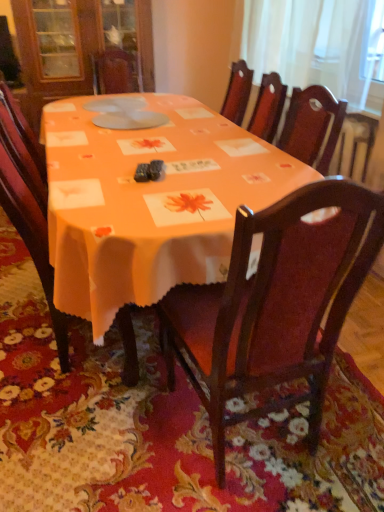
Question: Is wooden chair at center, marked as the 1th chair in a left-to-right arrangement, shorter than wooden chair at center, the first chair when ordered from right to left?

Choices:
 (A) no
 (B) yes

Answer: (B)

Question: From the image's perspective, does wooden chair at center, the 2th chair viewed from the right, appear lower than wooden chair at center, the first chair when ordered from right to left?

Choices:
 (A) yes
 (B) no

Answer: (B)

Question: Is wooden chair at center, the 2th chair viewed from the right, wider than wooden chair at center, the 2th chair when ordered from left to right?

Choices:
 (A) yes
 (B) no

Answer: (B)

Question: Is wooden chair at center, marked as the 1th chair in a left-to-right arrangement, positioned behind wooden chair at center, the first chair when ordered from right to left?

Choices:
 (A) no
 (B) yes

Answer: (B)

Question: From a real-world perspective, is wooden chair at center, the 2th chair viewed from the right, under wooden chair at center, the 2th chair when ordered from left to right?

Choices:
 (A) yes
 (B) no

Answer: (A)

Question: Is wooden chair at center, the 2th chair viewed from the right, oriented towards wooden chair at center, the first chair when ordered from right to left?

Choices:
 (A) yes
 (B) no

Answer: (B)

Question: From a real-world perspective, is orange fabric table at center located higher than wooden chair at center, the 2th chair viewed from the right?

Choices:
 (A) no
 (B) yes

Answer: (A)

Question: Is orange fabric table at center at the right side of wooden chair at center, marked as the 1th chair in a left-to-right arrangement?

Choices:
 (A) no
 (B) yes

Answer: (B)

Question: Considering the relative sizes of orange fabric table at center and wooden chair at center, the 2th chair viewed from the right, in the image provided, is orange fabric table at center thinner than wooden chair at center, the 2th chair viewed from the right,?

Choices:
 (A) no
 (B) yes

Answer: (A)

Question: From a real-world perspective, does orange fabric table at center sit lower than wooden chair at center, the 2th chair viewed from the right?

Choices:
 (A) yes
 (B) no

Answer: (A)

Question: Is orange fabric table at center facing away from wooden chair at center, the 2th chair viewed from the right?

Choices:
 (A) no
 (B) yes

Answer: (B)

Question: Can you confirm if orange fabric table at center is shorter than wooden chair at center, marked as the 1th chair in a left-to-right arrangement?

Choices:
 (A) no
 (B) yes

Answer: (B)

Question: Does wooden chair at center, the 2th chair when ordered from left to right, have a greater height compared to white sheer curtain at upper right?

Choices:
 (A) yes
 (B) no

Answer: (A)